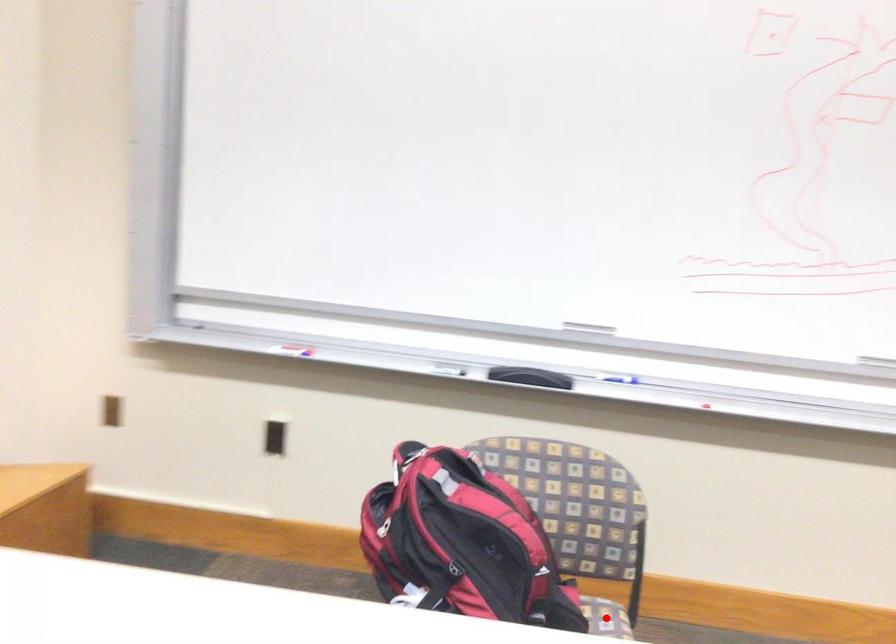
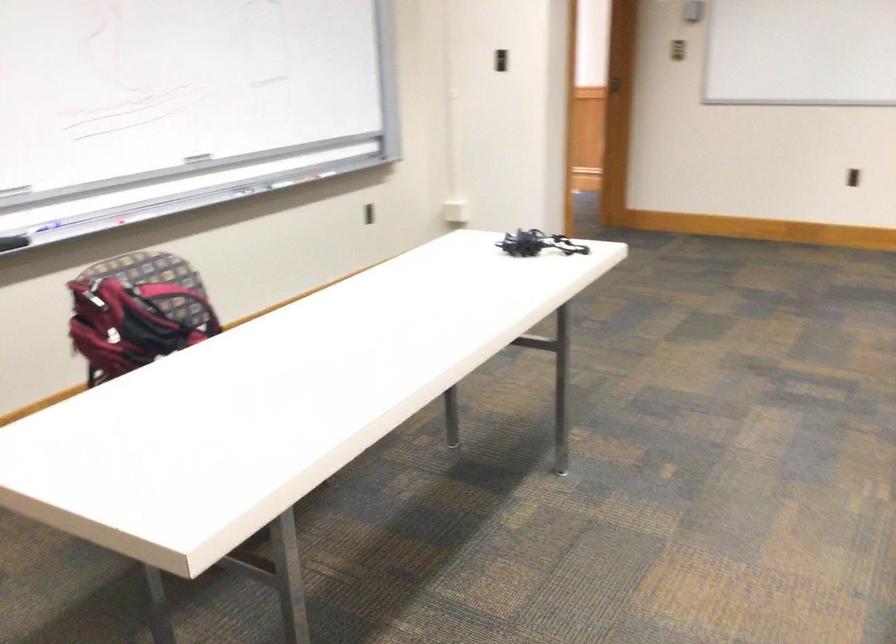
Question: I am providing you with two images of the same scene from different viewpoints. A red point is marked on the first image. Is the red point's position out of view in image 2?

Choices:
 (A) Yes
 (B) No

Answer: (A)